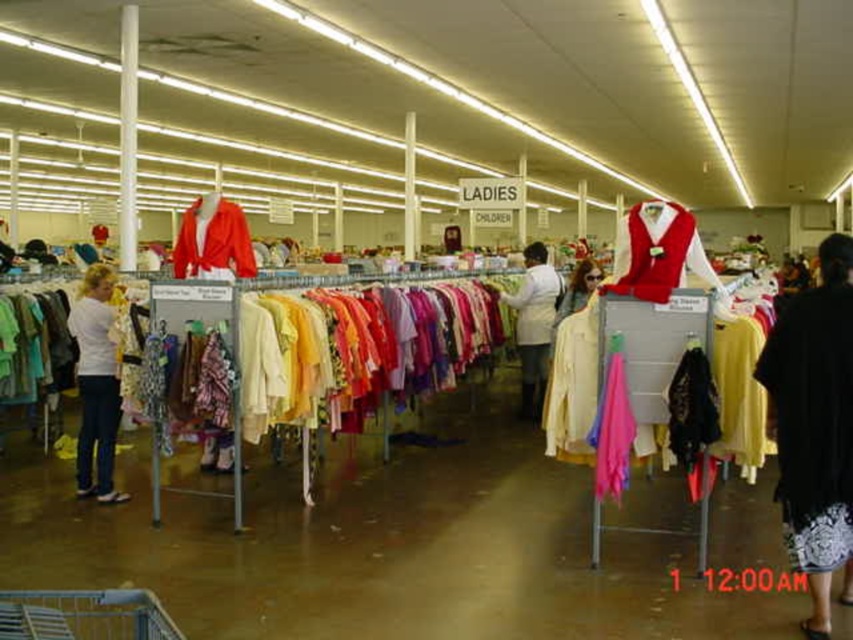
Does black matte dress at lower right appear over matte red blazer at center?

Actually, black matte dress at lower right is below matte red blazer at center.

Does black matte dress at lower right appear under matte red blazer at center?

Correct, black matte dress at lower right is located below matte red blazer at center.

Find the location of a particular element. The width and height of the screenshot is (853, 640). black matte dress at lower right is located at coordinates (811, 422).

Which is more to the right, matte red blazer at center or matte white blouse at center?

matte white blouse at center is more to the right.

In the scene shown: Does matte red blazer at center appear under matte white blouse at center?

Actually, matte red blazer at center is above matte white blouse at center.

Is point (210, 218) farther from camera compared to point (573, 308)?

No.

What are the coordinates of `matte red blazer at center` in the screenshot? It's located at (213, 241).

What do you see at coordinates (659, 252) in the screenshot? I see `velvet red vest at center` at bounding box center [659, 252].

Between point (616, 252) and point (535, 417), which one is positioned in front?

Point (616, 252) is in front.

Does point (695, 259) come closer to viewer compared to point (515, 332)?

That is True.

This screenshot has height=640, width=853. What are the coordinates of `velvet red vest at center` in the screenshot? It's located at (659, 252).